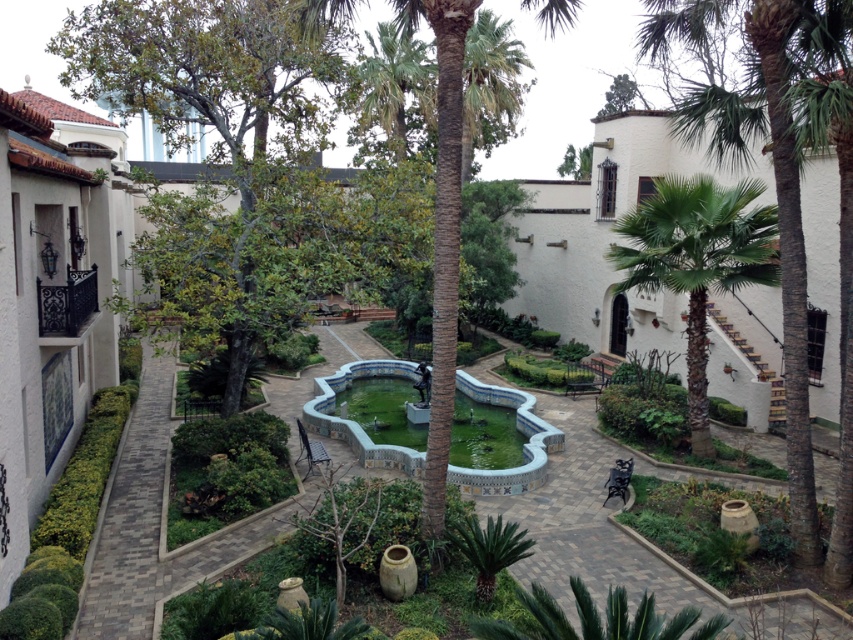
Who is shorter, green leafy tree at left or blue mosaic water at center?

With less height is blue mosaic water at center.

Does green leafy tree at left come in front of blue mosaic water at center?

Yes, it is.

Which is behind, point (202, 280) or point (402, 467)?

Positioned behind is point (402, 467).

At what (x,y) coordinates should I click in order to perform the action: click on green leafy tree at left. Please return your answer as a coordinate pair (x, y). The image size is (853, 640). Looking at the image, I should click on (218, 141).

Based on the photo, does green leafy tree at left have a lesser height compared to green leafy palm tree at right?

No, green leafy tree at left is not shorter than green leafy palm tree at right.

Does green leafy tree at left have a lesser width compared to green leafy palm tree at right?

In fact, green leafy tree at left might be wider than green leafy palm tree at right.

I want to click on green leafy tree at left, so click(218, 141).

Does green leafy palm tree at right have a smaller size compared to blue mosaic water at center?

Yes.

What are the coordinates of `green leafy palm tree at right` in the screenshot? It's located at (697, 260).